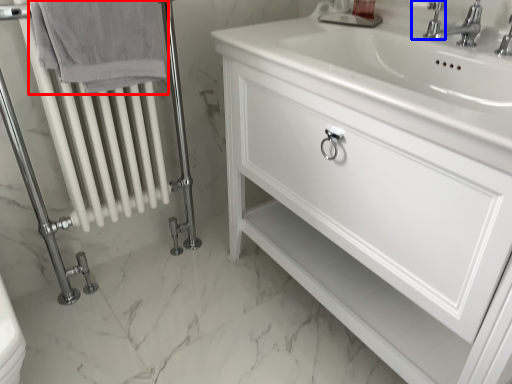
Question: Which point is further to the camera, bath towel (highlighted by a red box) or plumbing fixture (highlighted by a blue box)?

Choices:
 (A) bath towel
 (B) plumbing fixture

Answer: (B)